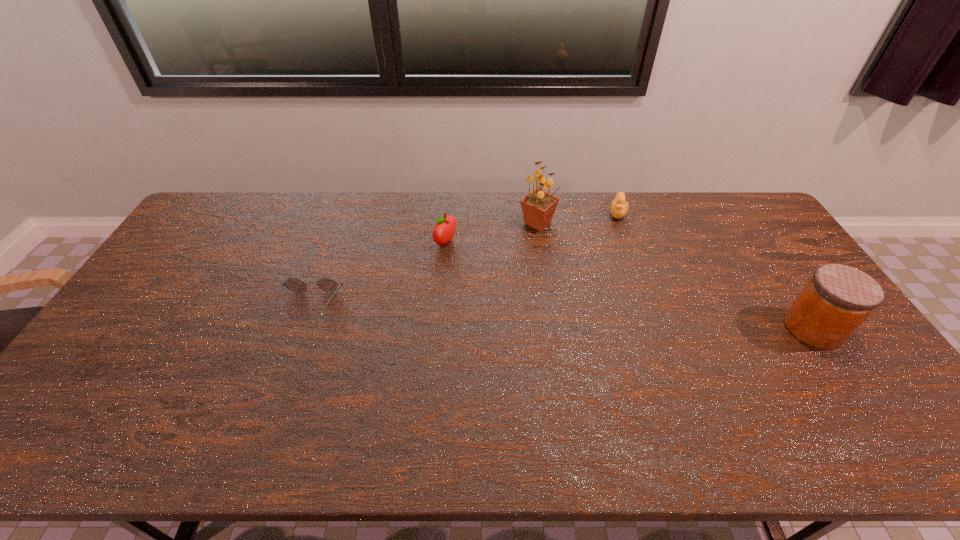
Find the location of `blank space located at the front of the sunflower with flowers visible`. blank space located at the front of the sunflower with flowers visible is located at coordinates (553, 267).

Image resolution: width=960 pixels, height=540 pixels. What are the coordinates of `duckling at the far edge` in the screenshot? It's located at (619, 207).

The image size is (960, 540). I want to click on sunflower located in the far edge section of the desktop, so click(x=538, y=207).

I want to click on object at the right edge, so click(x=837, y=299).

You are a GUI agent. You are given a task and a screenshot of the screen. Output one action in this format:
    pyautogui.click(x=<x>, y=<y>)
    Task: Click on the free spot at the far edge of the desktop
    The image size is (960, 540).
    Given the screenshot: What is the action you would take?
    pyautogui.click(x=651, y=221)

Identify the location of vacant region at the near edge of the desktop. (560, 397).

Locate an element on the screen. The width and height of the screenshot is (960, 540). free location at the right edge is located at coordinates (762, 281).

In the image, there is a desktop. Where is `vacant space at the near left corner`? vacant space at the near left corner is located at coordinates (80, 381).

The width and height of the screenshot is (960, 540). I want to click on free location at the far right corner of the desktop, so click(743, 221).

Where is `free point between the spectacles and the third shortest object`? This screenshot has width=960, height=540. free point between the spectacles and the third shortest object is located at coordinates (378, 275).